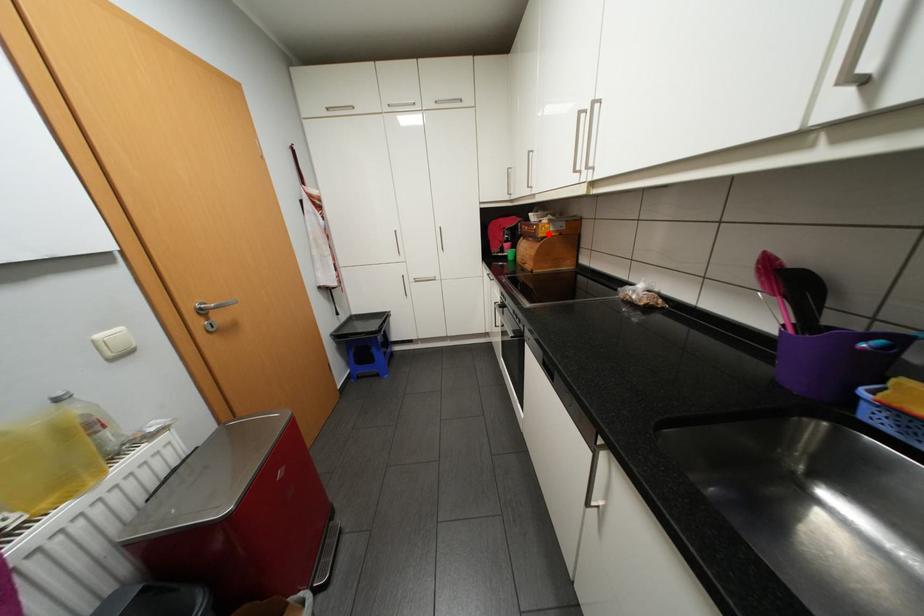
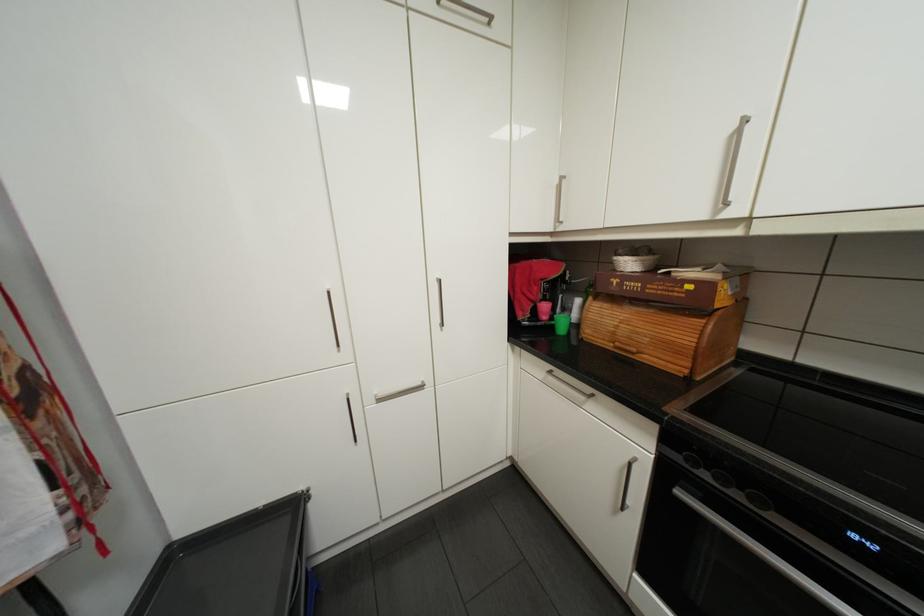
Question: I am providing you with two images of the same scene from different viewpoints. In image1, a red point is highlighted. Considering the same 3D point in image2, which of the following is correct?

Choices:
 (A) It is closer
 (B) It is farther

Answer: (B)